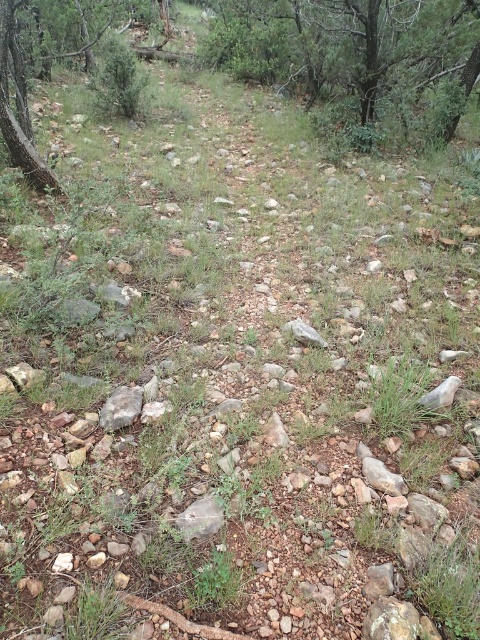
Question: Can you confirm if green leafy tree at upper center is smaller than gray rock at center?

Choices:
 (A) yes
 (B) no

Answer: (B)

Question: Can you confirm if green leafy tree at upper center is bigger than gray rock at center?

Choices:
 (A) yes
 (B) no

Answer: (A)

Question: Can you confirm if green leafy tree at upper center is wider than gray rock at center?

Choices:
 (A) yes
 (B) no

Answer: (A)

Question: Which of the following is the closest to the observer?

Choices:
 (A) (443, 19)
 (B) (386, 483)

Answer: (B)